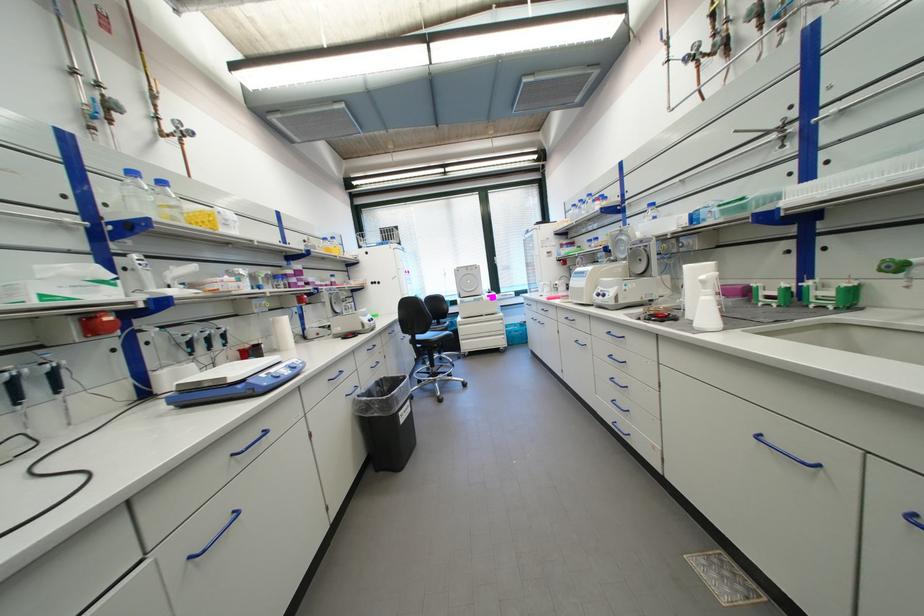
What are the coordinates of `green faucet handle` in the screenshot? It's located at (895, 265).